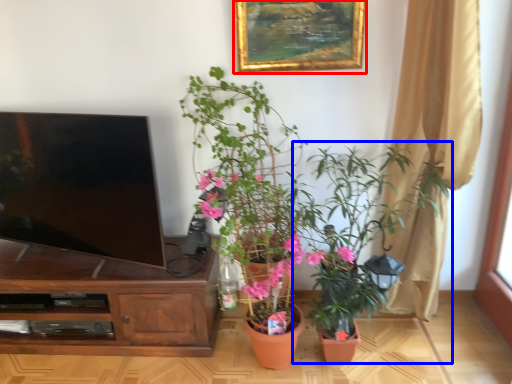
Question: Among these objects, which one is farthest to the camera, picture frame (highlighted by a red box) or houseplant (highlighted by a blue box)?

Choices:
 (A) picture frame
 (B) houseplant

Answer: (A)